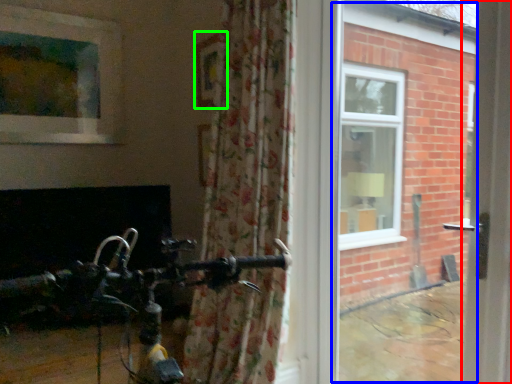
Question: Which object is positioned farthest from screen door (highlighted by a red box)? Select from window frame (highlighted by a blue box) and picture frame (highlighted by a green box).

Choices:
 (A) window frame
 (B) picture frame

Answer: (A)